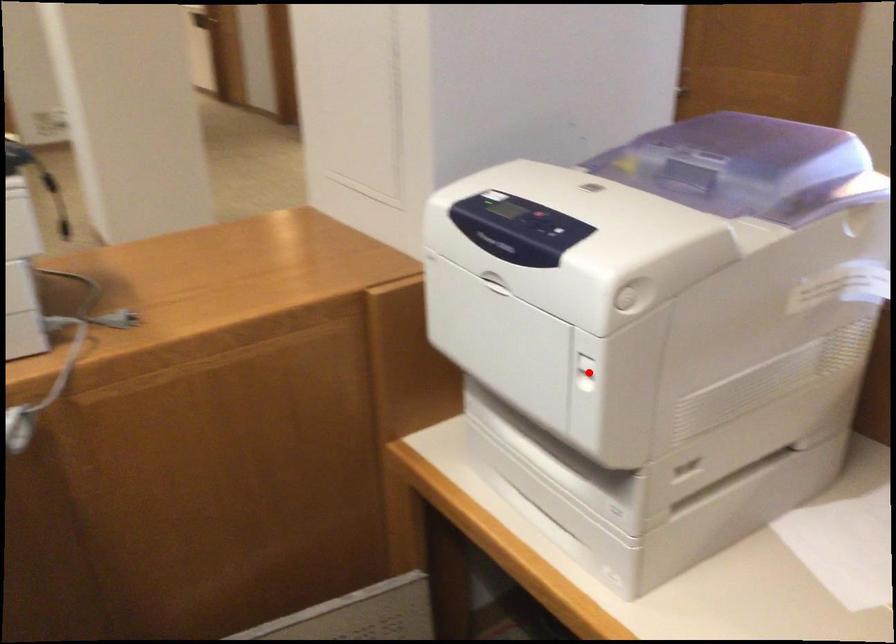
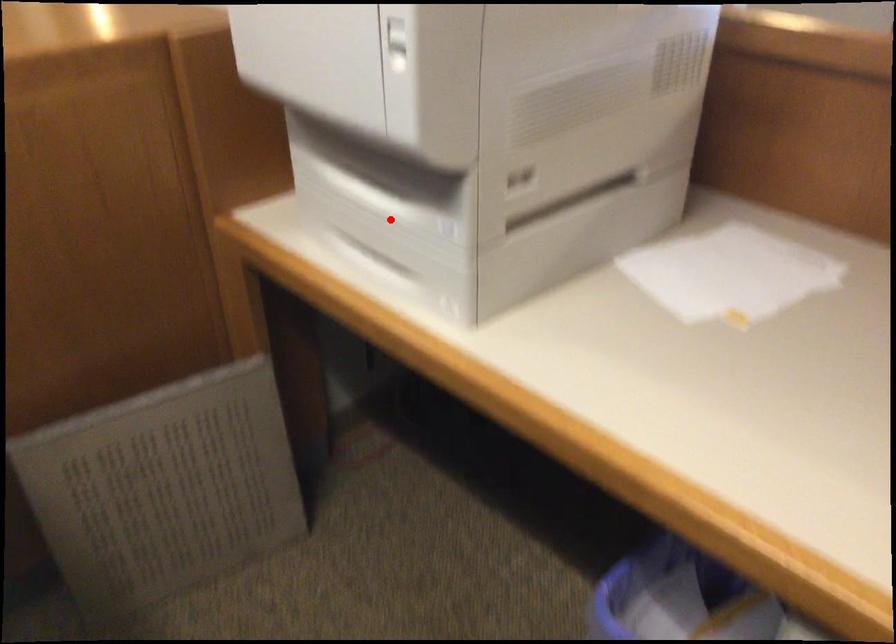
I am providing you with two images of the same scene from different viewpoints. A red point is marked on the first image and another point is marked on the second image. Is the red point in image1 aligned with the point shown in image2?

No